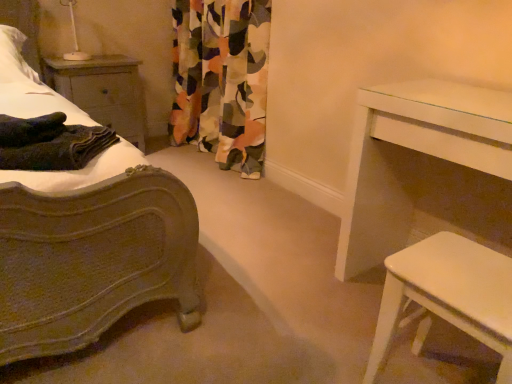
Identify the location of vacant space situated above white glossy stool at lower right, the 2th table viewed from the back (from a real-world perspective). Image resolution: width=512 pixels, height=384 pixels. (459, 269).